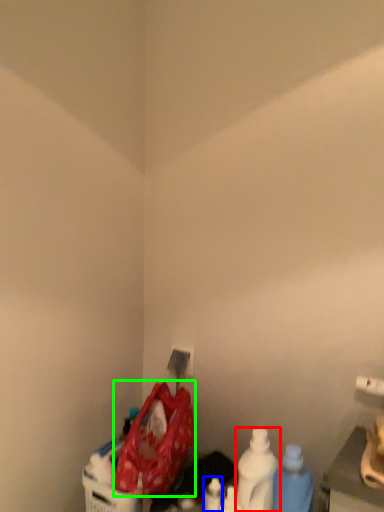
Question: Considering the real-world distances, which object is farthest from bottle (highlighted by a red box)? bottle (highlighted by a blue box) or waste (highlighted by a green box)?

Choices:
 (A) bottle
 (B) waste

Answer: (B)